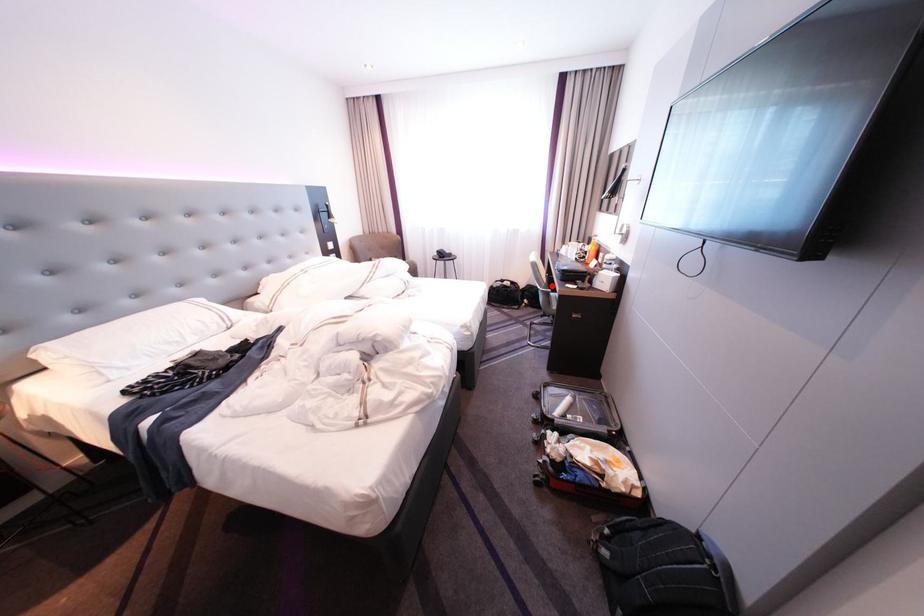
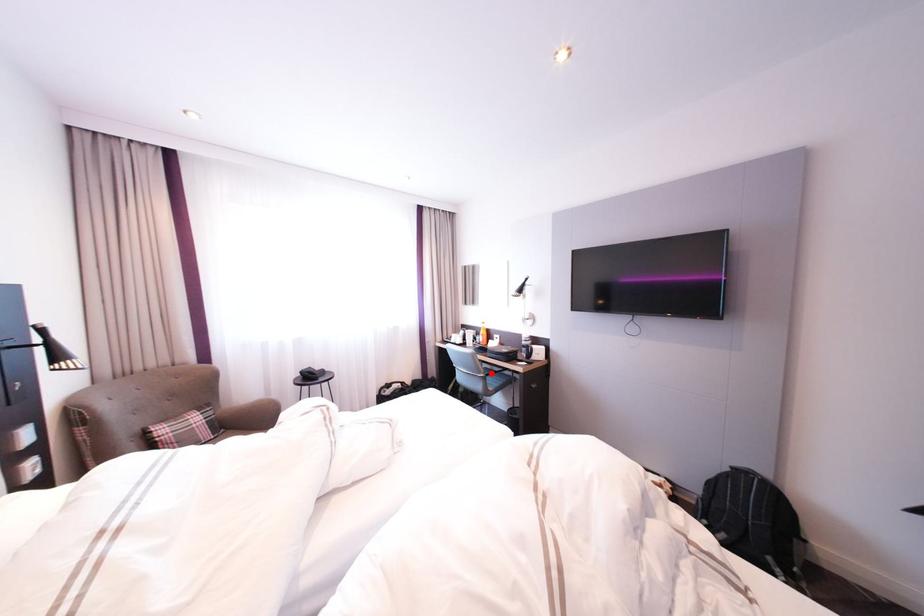
I am providing you with two images of the same scene from different viewpoints. A red point is marked on the first image and another point is marked on the second image. Does the point marked in image1 correspond to the same location as the one in image2?

Yes